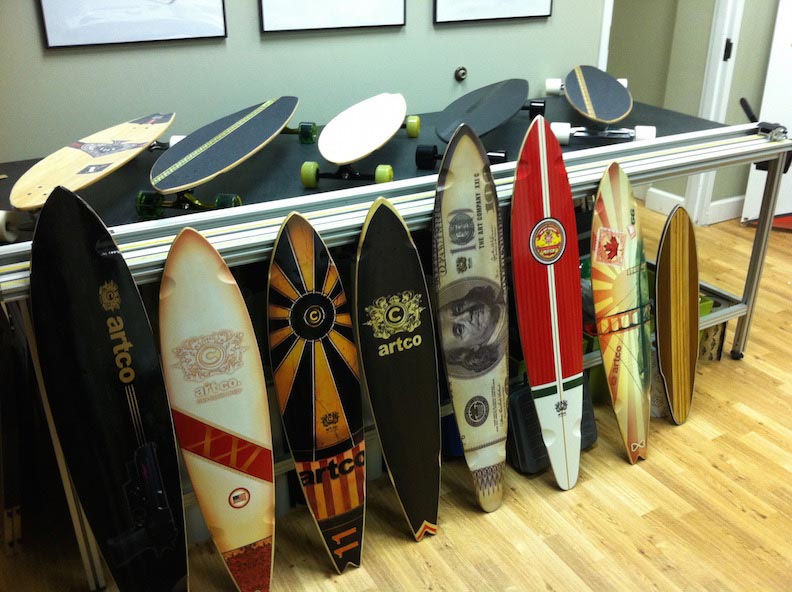
This screenshot has height=592, width=792. In order to click on door mat in this screenshot , I will do `click(782, 225)`.